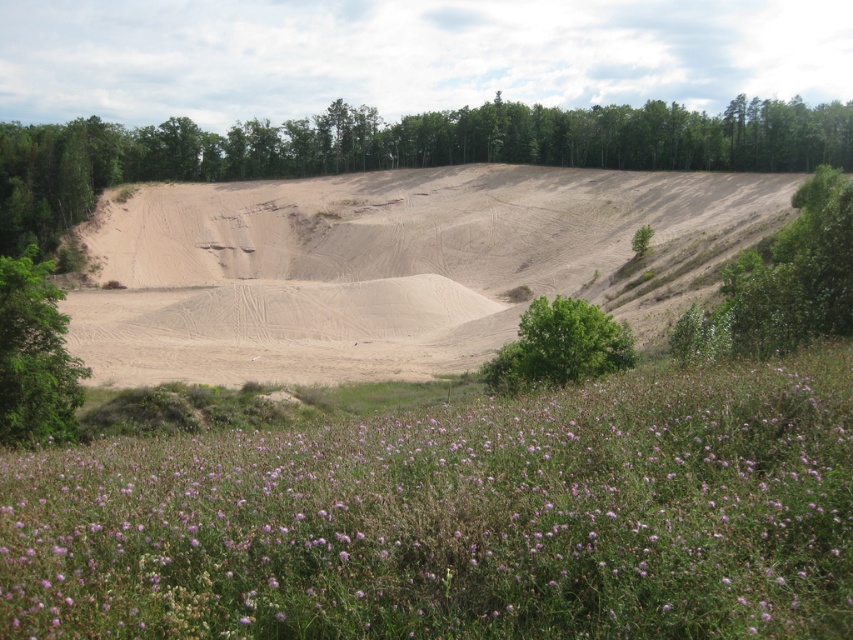
Question: Is light brown sand dune at center smaller than green leafy tree at center?

Choices:
 (A) yes
 (B) no

Answer: (B)

Question: Which point is closer to the camera taking this photo?

Choices:
 (A) (537, 314)
 (B) (62, 376)
 (C) (488, 300)

Answer: (B)

Question: Estimate the real-world distances between objects in this image. Which object is closer to the green leafy tree at left?

Choices:
 (A) green leafy tree at upper center
 (B) light brown sand dune at center
 (C) green leafy tree at right

Answer: (C)

Question: Does purple grass at lower center have a smaller size compared to green leafy tree at left?

Choices:
 (A) no
 (B) yes

Answer: (B)

Question: Is light brown sand dune at center closer to camera compared to green leafy tree at upper center?

Choices:
 (A) no
 (B) yes

Answer: (B)

Question: Among these points, which one is nearest to the camera?

Choices:
 (A) (41, 132)
 (B) (42, 275)
 (C) (563, 324)
 (D) (851, 260)

Answer: (D)